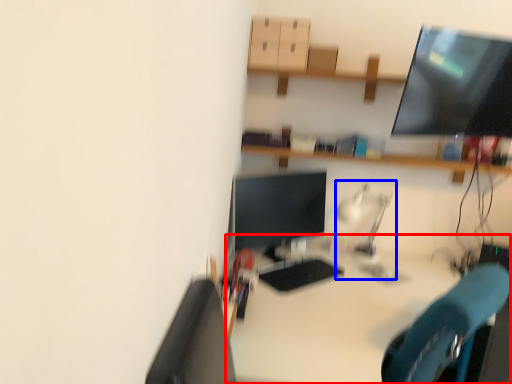
Question: Among these objects, which one is nearest to the camera, desk (highlighted by a red box) or table lamp (highlighted by a blue box)?

Choices:
 (A) desk
 (B) table lamp

Answer: (A)